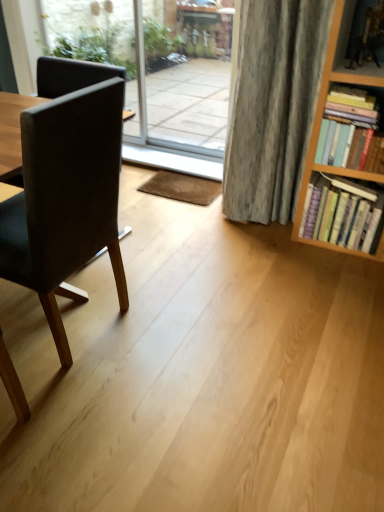
Question: Is hardcover books at right, arranged as the second book when viewed from the top, turned away from transparent glass screen door at center?

Choices:
 (A) no
 (B) yes

Answer: (A)

Question: Does hardcover books at right, arranged as the first book when ordered from the bottom, have a greater height compared to transparent glass screen door at center?

Choices:
 (A) no
 (B) yes

Answer: (A)

Question: Is hardcover books at right, arranged as the first book when ordered from the bottom, outside of transparent glass screen door at center?

Choices:
 (A) yes
 (B) no

Answer: (A)

Question: Is the position of hardcover books at right, arranged as the second book when viewed from the top, less distant than that of transparent glass screen door at center?

Choices:
 (A) no
 (B) yes

Answer: (B)

Question: Is hardcover books at right, arranged as the second book when viewed from the top, behind transparent glass screen door at center?

Choices:
 (A) no
 (B) yes

Answer: (A)

Question: Does hardcover books at right, arranged as the second book when viewed from the top, appear on the left side of transparent glass screen door at center?

Choices:
 (A) yes
 (B) no

Answer: (B)

Question: Considering the relative sizes of transparent glass screen door at center and hardcover books at right, arranged as the second book when viewed from the top, in the image provided, is transparent glass screen door at center wider than hardcover books at right, arranged as the second book when viewed from the top,?

Choices:
 (A) yes
 (B) no

Answer: (B)

Question: From the image's perspective, does transparent glass screen door at center appear higher than hardcover books at right, arranged as the second book when viewed from the top?

Choices:
 (A) yes
 (B) no

Answer: (A)

Question: Is transparent glass screen door at center smaller than hardcover books at right, arranged as the second book when viewed from the top?

Choices:
 (A) yes
 (B) no

Answer: (B)

Question: Can you confirm if transparent glass screen door at center is shorter than hardcover books at right, arranged as the first book when ordered from the bottom?

Choices:
 (A) no
 (B) yes

Answer: (A)

Question: From a real-world perspective, is transparent glass screen door at center physically above hardcover books at right, arranged as the first book when ordered from the bottom?

Choices:
 (A) yes
 (B) no

Answer: (A)

Question: Considering the relative sizes of transparent glass screen door at center and hardcover books at right, arranged as the first book when ordered from the bottom, in the image provided, is transparent glass screen door at center taller than hardcover books at right, arranged as the first book when ordered from the bottom,?

Choices:
 (A) yes
 (B) no

Answer: (A)

Question: Would you say transparent glass screen door at center is a long distance from matte black chair at left?

Choices:
 (A) yes
 (B) no

Answer: (A)